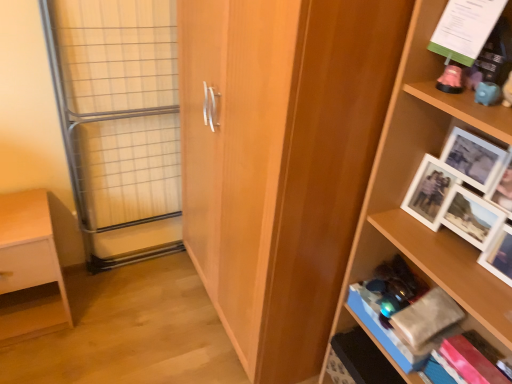
Question: From a real-world perspective, relative to wooden shelf at right, which ranks as the 1th shelf in right-to-left order, is wooden cupboard at center vertically above or below?

Choices:
 (A) below
 (B) above

Answer: (A)

Question: Does point (201, 31) appear closer or farther from the camera than point (393, 203)?

Choices:
 (A) farther
 (B) closer

Answer: (A)

Question: Estimate the real-world distances between objects in this image. Which object is farther from the clear glass door at left?

Choices:
 (A) pink plastic piggy bank at upper right, positioned as the second shelf in left-to-right order
 (B) wooden cupboard at center
 (C) white matte wooden shelf at lower left, acting as the first shelf starting from the left
 (D) wooden shelf at right, marked as the third shelf in a left-to-right arrangement

Answer: (A)

Question: Which is farther from the wooden shelf at right, which ranks as the 1th shelf in right-to-left order?

Choices:
 (A) pink plastic piggy bank at upper right, which appears as the second shelf when viewed from the right
 (B) wooden cupboard at center
 (C) clear glass door at left
 (D) white matte wooden shelf at lower left, which is counted as the third shelf, starting from the right

Answer: (D)